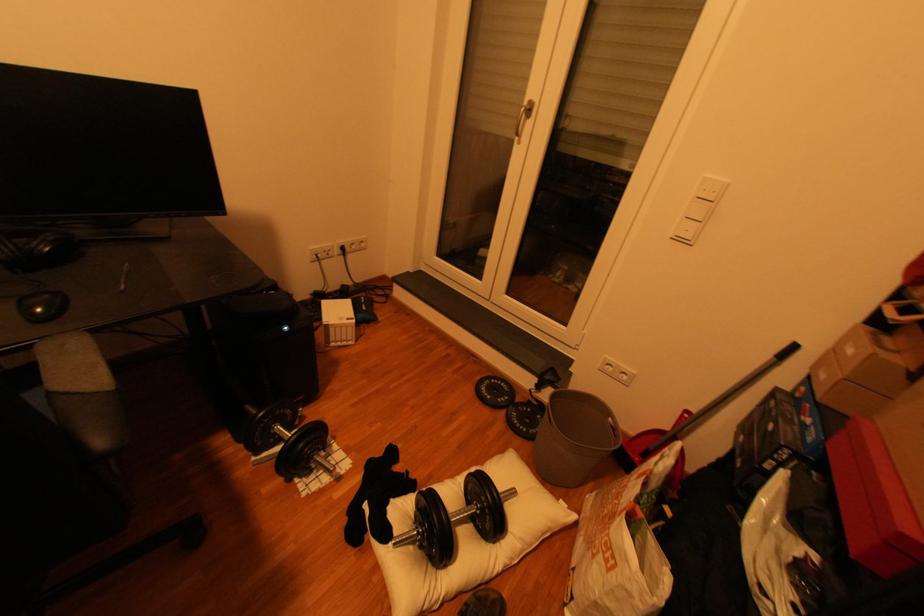
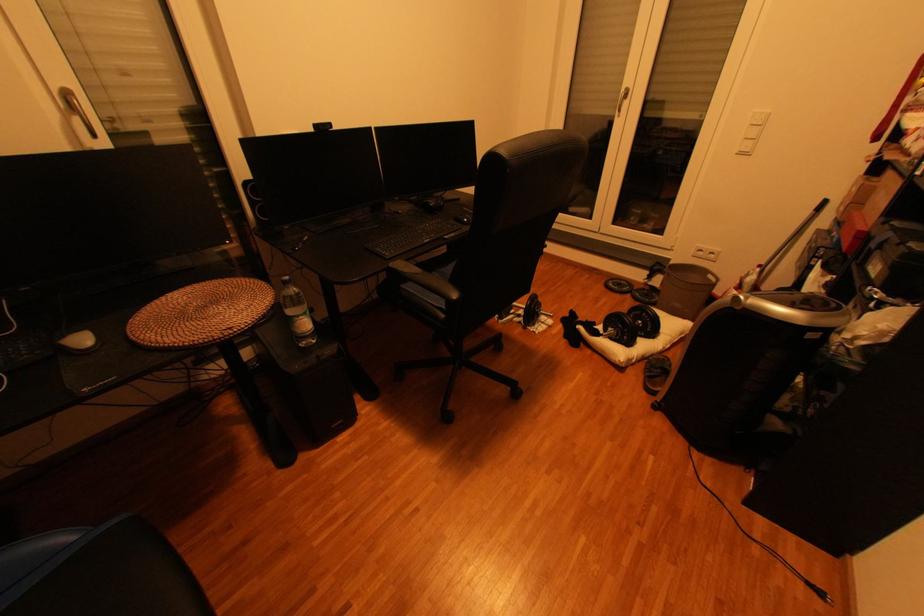
Locate, in the second image, the point that corresponds to point 537,103 in the first image.

(633, 91)